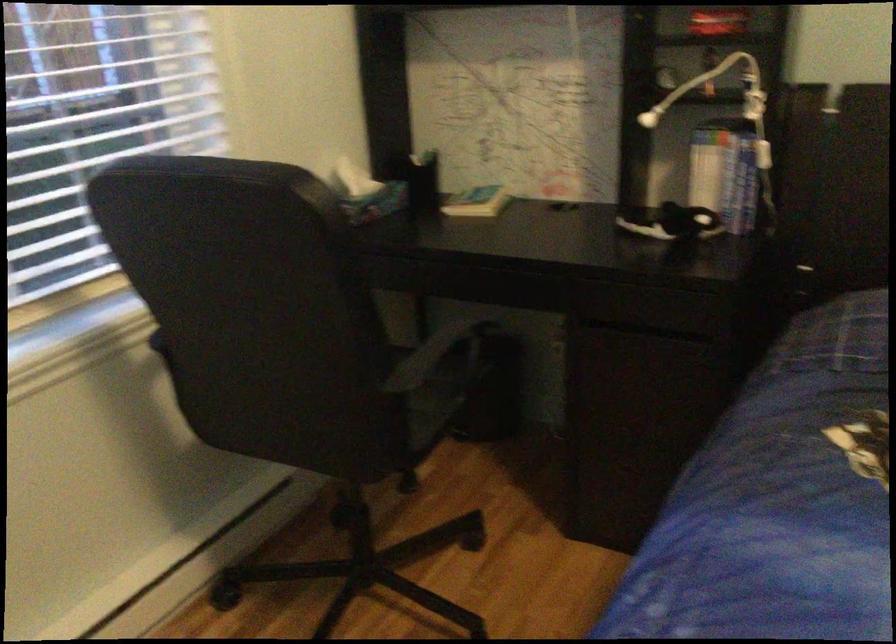
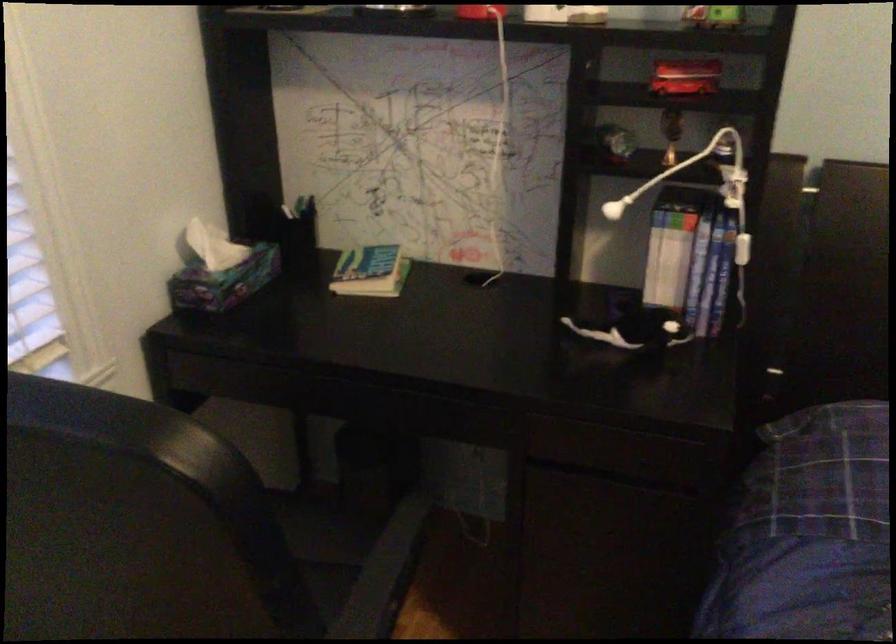
Where in the second image is the point corresponding to point (355, 176) from the first image?

(213, 245)